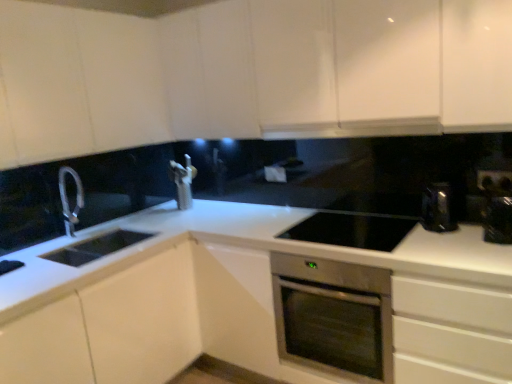
What is the approximate width of black plastic electric outlet at upper right?

It is 0.60 inches.

Describe the element at coordinates (494, 180) in the screenshot. Image resolution: width=512 pixels, height=384 pixels. I see `black plastic electric outlet at upper right` at that location.

Identify the location of white glossy countertop at center. (243, 301).

What do you see at coordinates (352, 230) in the screenshot? I see `black glass cooktop at center, which is the second appliance in right-to-left order` at bounding box center [352, 230].

Where is `stainless steel oven at center`? This screenshot has width=512, height=384. stainless steel oven at center is located at coordinates (334, 316).

This screenshot has width=512, height=384. I want to click on black plastic electric outlet at upper right, so click(x=494, y=180).

Between white glossy cabinet at upper left, arranged as the second cabinetry when ordered from the bottom, and stainless steel oven at center, which one is positioned in front?

white glossy cabinet at upper left, arranged as the second cabinetry when ordered from the bottom, is in front.

From the image's perspective, is white glossy cabinet at upper left, the 2th cabinetry in the top-to-bottom sequence, on stainless steel oven at center?

Yes, from the image's perspective, white glossy cabinet at upper left, the 2th cabinetry in the top-to-bottom sequence, is on top of stainless steel oven at center.

From a real-world perspective, is white glossy cabinet at upper left, the 2th cabinetry in the top-to-bottom sequence, physically above stainless steel oven at center?

Yes, from a real-world perspective, white glossy cabinet at upper left, the 2th cabinetry in the top-to-bottom sequence, is over stainless steel oven at center

Between white glossy cabinet at upper left, the 2th cabinetry in the top-to-bottom sequence, and stainless steel oven at center, which one has larger width?

With larger width is stainless steel oven at center.

Considering the sizes of objects black glass cooktop at center, which is the second appliance in right-to-left order, and black plastic electric outlet at upper right in the image provided, who is thinner, black glass cooktop at center, which is the second appliance in right-to-left order, or black plastic electric outlet at upper right?

With smaller width is black plastic electric outlet at upper right.

Starting from the black plastic electric outlet at upper right, which appliance is the 1st one in front? Please provide its 2D coordinates.

[(352, 230)]

Is black glass cooktop at center, positioned as the 1th appliance in left-to-right order, touching black plastic electric outlet at upper right?

No, black glass cooktop at center, positioned as the 1th appliance in left-to-right order, is not with black plastic electric outlet at upper right.

Is white glossy countertop at center oriented away from metallic silver toaster at right, the first appliance viewed from the right?

No, white glossy countertop at center is not facing the opposite direction of metallic silver toaster at right, the first appliance viewed from the right.

Does white glossy countertop at center have a smaller size compared to metallic silver toaster at right, the first appliance viewed from the right?

No, white glossy countertop at center is not smaller than metallic silver toaster at right, the first appliance viewed from the right.

How much distance is there between white glossy countertop at center and metallic silver toaster at right, the first appliance viewed from the right?

white glossy countertop at center and metallic silver toaster at right, the first appliance viewed from the right, are 3.29 feet apart from each other.

How different are the orientations of white glossy countertop at center and metallic silver toaster at right, the first appliance viewed from the right, in degrees?

white glossy countertop at center and metallic silver toaster at right, the first appliance viewed from the right, are facing 0.000799 degrees away from each other.

From a real-world perspective, which object stands above the other?

white glossy exhaust hood at upper center is physically above.

Is point (275, 130) closer to viewer compared to point (486, 224)?

No, (275, 130) is further to viewer.

Who is bigger, white glossy exhaust hood at upper center or metallic silver toaster at right, the second appliance viewed from the left?

Bigger between the two is white glossy exhaust hood at upper center.

Can you tell me how much black plastic electric outlet at upper right and stainless steel oven at center differ in facing direction?

The angle between the facing direction of black plastic electric outlet at upper right and the facing direction of stainless steel oven at center is 0.0904 degrees.

Is black plastic electric outlet at upper right to the right of stainless steel oven at center from the viewer's perspective?

Yes.

Is black plastic electric outlet at upper right oriented towards stainless steel oven at center?

No, black plastic electric outlet at upper right is not aimed at stainless steel oven at center.

Measure the distance between black plastic electric outlet at upper right and white glossy cabinet at upper center, positioned as the 1th cabinetry in top-to-bottom order.

black plastic electric outlet at upper right is 4.09 feet from white glossy cabinet at upper center, positioned as the 1th cabinetry in top-to-bottom order.

Who is bigger, black plastic electric outlet at upper right or white glossy cabinet at upper center, positioned as the 1th cabinetry in top-to-bottom order?

white glossy cabinet at upper center, positioned as the 1th cabinetry in top-to-bottom order.

Which object is positioned more to the right, black plastic electric outlet at upper right or white glossy cabinet at upper center, positioned as the 1th cabinetry in top-to-bottom order?

Positioned to the right is black plastic electric outlet at upper right.

From the image's perspective, between black plastic electric outlet at upper right and white glossy cabinet at upper left, arranged as the second cabinetry when ordered from the bottom, who is located below?

black plastic electric outlet at upper right is shown below in the image.

Does black plastic electric outlet at upper right touch white glossy cabinet at upper left, arranged as the second cabinetry when ordered from the bottom?

black plastic electric outlet at upper right and white glossy cabinet at upper left, arranged as the second cabinetry when ordered from the bottom, are clearly separated.

From a real-world perspective, relative to white glossy cabinet at upper left, the 2th cabinetry in the top-to-bottom sequence, is black plastic electric outlet at upper right vertically above or below?

Clearly, from a real-world perspective, black plastic electric outlet at upper right is below white glossy cabinet at upper left, the 2th cabinetry in the top-to-bottom sequence.

Can you tell me how much black plastic electric outlet at upper right and white glossy cabinet at upper left, arranged as the second cabinetry when ordered from the bottom, differ in facing direction?

They differ by 90 degrees in their facing directions.

At what (x,y) coordinates should I click in order to perform the action: click on home appliance lying on the right of white glossy cabinet at upper left, arranged as the second cabinetry when ordered from the bottom. Please return your answer as a coordinate pair (x, y). The image size is (512, 384). Looking at the image, I should click on (334, 316).

I want to click on appliance that is the 1st object located in front of the black plastic electric outlet at upper right, so click(x=352, y=230).

Estimate the real-world distances between objects in this image. Which object is closer to white glossy cabinet at upper center, positioned as the 1th cabinetry in top-to-bottom order, white matte cabinet at left, acting as the 1th cabinetry starting from the bottom, or white glossy cabinet at upper left, arranged as the second cabinetry when ordered from the bottom?

white glossy cabinet at upper left, arranged as the second cabinetry when ordered from the bottom, is closer to white glossy cabinet at upper center, positioned as the 1th cabinetry in top-to-bottom order.

Looking at the image, which one is located further to white glossy countertop at center, white glossy cabinet at upper center, which is the third cabinetry from bottom to top, or white glossy exhaust hood at upper center?

white glossy exhaust hood at upper center is further to white glossy countertop at center.

Considering their positions, is white glossy cabinet at upper left, the 2th cabinetry in the top-to-bottom sequence, positioned closer to black glass cooktop at center, positioned as the 1th appliance in left-to-right order, than white matte cabinet at left, acting as the 1th cabinetry starting from the bottom?

Among the two, white matte cabinet at left, acting as the 1th cabinetry starting from the bottom, is located nearer to black glass cooktop at center, positioned as the 1th appliance in left-to-right order.

Looking at the image, which one is located further to white glossy cabinet at upper center, positioned as the 1th cabinetry in top-to-bottom order, white matte cabinet at left, the 3th cabinetry viewed from the top, or white glossy exhaust hood at upper center?

white matte cabinet at left, the 3th cabinetry viewed from the top.

Based on their spatial positions, is white glossy countertop at center or white glossy exhaust hood at upper center further from black plastic electric outlet at upper right?

The object further to black plastic electric outlet at upper right is white glossy countertop at center.

Which object lies further to the anchor point black glass cooktop at center, which is the second appliance in right-to-left order, white glossy exhaust hood at upper center or white matte cabinet at left, acting as the 1th cabinetry starting from the bottom?

white matte cabinet at left, acting as the 1th cabinetry starting from the bottom, is positioned further to the anchor black glass cooktop at center, which is the second appliance in right-to-left order.

When comparing their distances from white glossy exhaust hood at upper center, does metallic silver toaster at right, the first appliance viewed from the right, or white glossy cabinet at upper center, positioned as the 1th cabinetry in top-to-bottom order, seem further?

The object further to white glossy exhaust hood at upper center is metallic silver toaster at right, the first appliance viewed from the right.

Based on their spatial positions, is white glossy cabinet at upper center, which is the third cabinetry from bottom to top, or stainless steel oven at center closer to white glossy countertop at center?

stainless steel oven at center.

The height and width of the screenshot is (384, 512). I want to click on exhaust hood between white glossy cabinet at upper center, which is the third cabinetry from bottom to top, and stainless steel oven at center vertically, so click(354, 129).

Find the location of `exhaust hood between white glossy cabinet at upper center, which is the third cabinetry from bottom to top, and metallic silver toaster at right, the second appliance viewed from the left`. exhaust hood between white glossy cabinet at upper center, which is the third cabinetry from bottom to top, and metallic silver toaster at right, the second appliance viewed from the left is located at coordinates (354, 129).

Locate an element on the screen. This screenshot has width=512, height=384. electric outlet between white glossy exhaust hood at upper center and white glossy countertop at center vertically is located at coordinates (494, 180).

What are the coordinates of `exhaust hood located between white matte cabinet at left, acting as the 1th cabinetry starting from the bottom, and metallic silver toaster at right, the second appliance viewed from the left, in the left-right direction` in the screenshot? It's located at (354, 129).